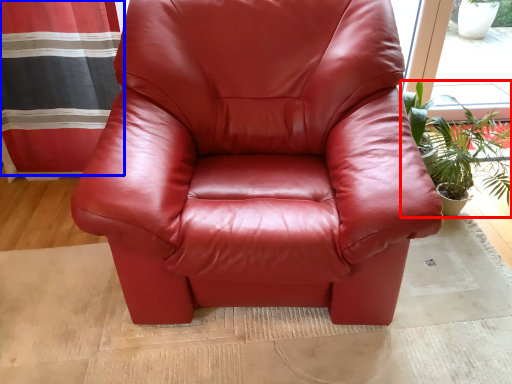
Question: Which point is closer to the camera, houseplant (highlighted by a red box) or curtain (highlighted by a blue box)?

Choices:
 (A) houseplant
 (B) curtain

Answer: (A)